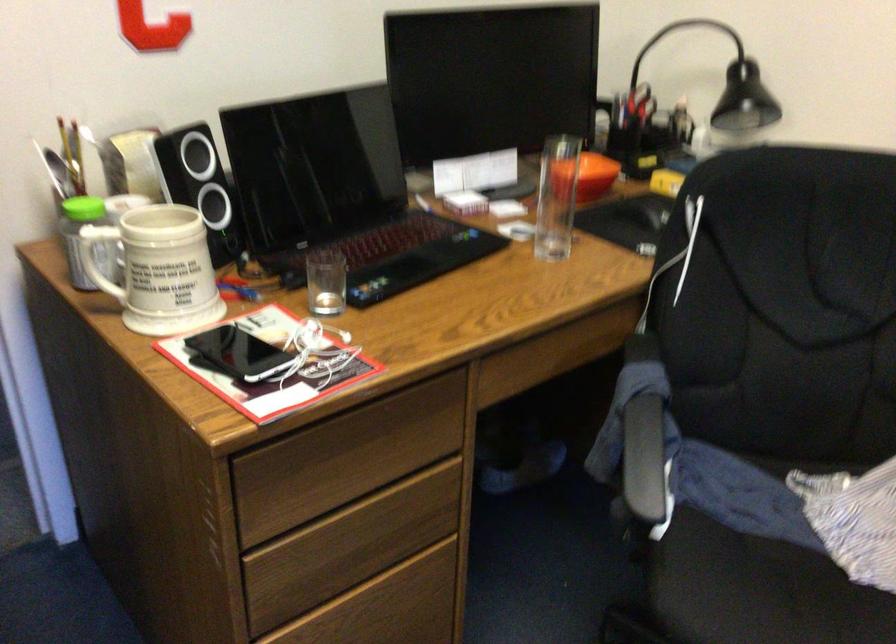
Question: The camera is either moving clockwise (left) or counter-clockwise (right) around the object. The first image is from the beginning of the video and the second image is from the end. Is the camera moving left or right when shooting the video?

Choices:
 (A) Left
 (B) Right

Answer: (B)